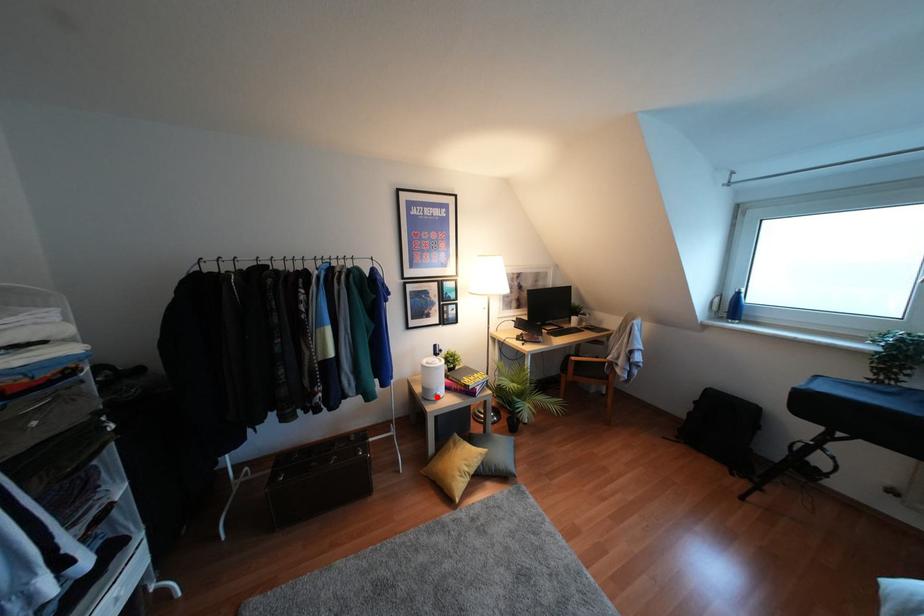
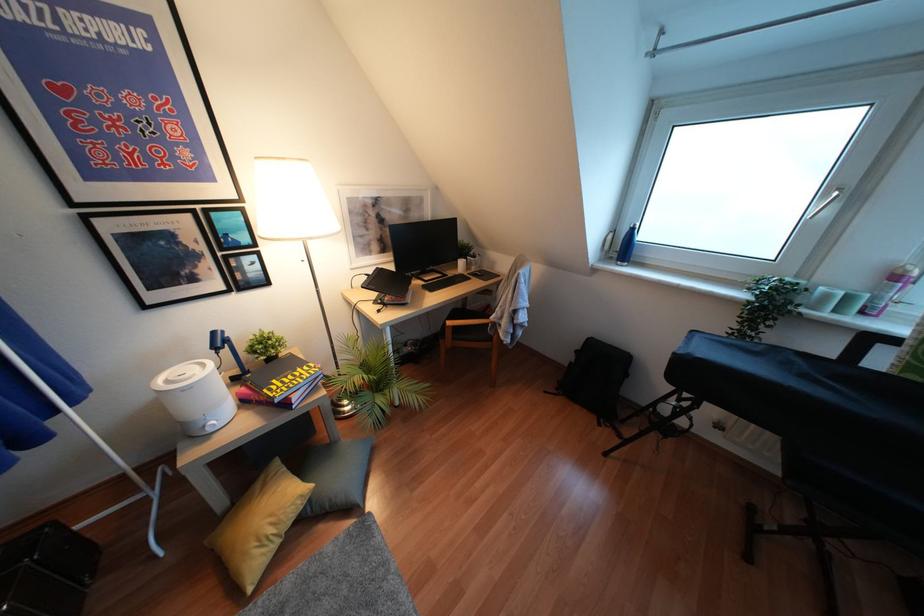
Question: I am providing you with two images of the same scene from different viewpoints. A red point is shown in image1. For the corresponding object point in image2, is it positioned nearer or farther from the camera?

Choices:
 (A) Nearer
 (B) Farther

Answer: (A)